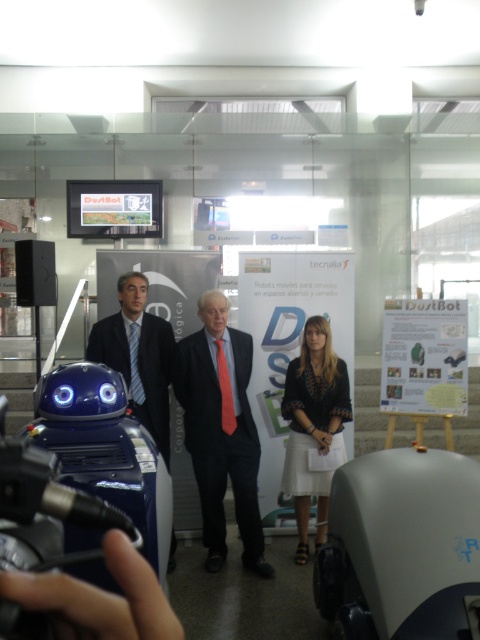
Does matte black suit at center have a larger size compared to black textured blouse at center?

Indeed, matte black suit at center has a larger size compared to black textured blouse at center.

Is point (220, 554) positioned before point (299, 444)?

That is True.

Image resolution: width=480 pixels, height=640 pixels. Describe the element at coordinates (220, 429) in the screenshot. I see `matte black suit at center` at that location.

Where is `matte black suit at center`? This screenshot has height=640, width=480. matte black suit at center is located at coordinates (220, 429).

Is matte black suit at center above blue silk suit at center?

No, matte black suit at center is not above blue silk suit at center.

Between matte black suit at center and blue silk suit at center, which one is positioned lower?

matte black suit at center

Find the location of a particular element. The height and width of the screenshot is (640, 480). matte black suit at center is located at coordinates (220, 429).

Looking at this image, which of these two, black textured blouse at center or blue silk suit at center, stands taller?

Standing taller between the two is black textured blouse at center.

Does point (319, 360) lie in front of point (111, 324)?

Yes, point (319, 360) is closer to viewer.

I want to click on black textured blouse at center, so click(312, 424).